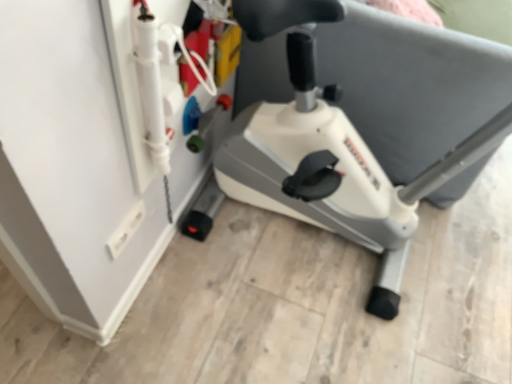
Question: Does white plastic electric outlet at lower left have a larger size compared to white plastic stationary bicycle at center?

Choices:
 (A) yes
 (B) no

Answer: (B)

Question: Is white plastic stationary bicycle at center at the back of white plastic electric outlet at lower left?

Choices:
 (A) yes
 (B) no

Answer: (B)

Question: Is white plastic stationary bicycle at center a part of white plastic electric outlet at lower left?

Choices:
 (A) yes
 (B) no

Answer: (B)

Question: Is white plastic electric outlet at lower left positioned beyond the bounds of white plastic stationary bicycle at center?

Choices:
 (A) yes
 (B) no

Answer: (A)

Question: From the image's perspective, would you say white plastic electric outlet at lower left is positioned over white plastic stationary bicycle at center?

Choices:
 (A) yes
 (B) no

Answer: (B)

Question: Is the position of white plastic electric outlet at lower left more distant than that of white plastic stationary bicycle at center?

Choices:
 (A) yes
 (B) no

Answer: (A)

Question: Does white plastic stationary bicycle at center have a lesser width compared to white plastic electric outlet at lower left?

Choices:
 (A) no
 (B) yes

Answer: (A)

Question: Is white plastic stationary bicycle at center outside of white plastic electric outlet at lower left?

Choices:
 (A) no
 (B) yes

Answer: (B)

Question: Considering the relative sizes of white plastic stationary bicycle at center and white plastic electric outlet at lower left in the image provided, is white plastic stationary bicycle at center wider than white plastic electric outlet at lower left?

Choices:
 (A) no
 (B) yes

Answer: (B)

Question: Is the depth of white plastic stationary bicycle at center less than that of white plastic electric outlet at lower left?

Choices:
 (A) no
 (B) yes

Answer: (B)

Question: Is white plastic stationary bicycle at center to the right of white plastic electric outlet at lower left from the viewer's perspective?

Choices:
 (A) no
 (B) yes

Answer: (B)

Question: From the image's perspective, is white plastic stationary bicycle at center over white plastic electric outlet at lower left?

Choices:
 (A) yes
 (B) no

Answer: (A)

Question: From a real-world perspective, is white plastic electric outlet at lower left above or below white plastic stationary bicycle at center?

Choices:
 (A) above
 (B) below

Answer: (B)